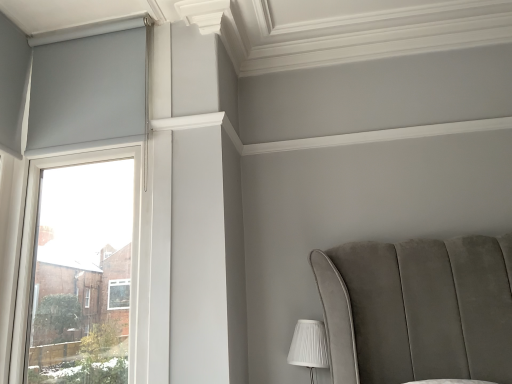
Question: Is matte gray roller blind at left smaller than white pleated fabric at lower right?

Choices:
 (A) yes
 (B) no

Answer: (B)

Question: Would you say matte gray roller blind at left is a long distance from white pleated fabric at lower right?

Choices:
 (A) yes
 (B) no

Answer: (A)

Question: Is the depth of matte gray roller blind at left greater than that of white pleated fabric at lower right?

Choices:
 (A) no
 (B) yes

Answer: (A)

Question: Is matte gray roller blind at left to the left of white pleated fabric at lower right from the viewer's perspective?

Choices:
 (A) yes
 (B) no

Answer: (A)

Question: Is matte gray roller blind at left positioned with its back to white pleated fabric at lower right?

Choices:
 (A) yes
 (B) no

Answer: (B)

Question: From a real-world perspective, is matte gray roller blind at left located higher than white pleated fabric at lower right?

Choices:
 (A) yes
 (B) no

Answer: (A)

Question: From the image's perspective, is white pleated fabric at lower right above matte gray roller blind at left?

Choices:
 (A) no
 (B) yes

Answer: (A)

Question: Is matte gray roller blind at left inside white pleated fabric at lower right?

Choices:
 (A) yes
 (B) no

Answer: (B)

Question: Is the position of white pleated fabric at lower right less distant than that of matte gray roller blind at left?

Choices:
 (A) yes
 (B) no

Answer: (B)

Question: From a real-world perspective, is white pleated fabric at lower right on top of matte gray roller blind at left?

Choices:
 (A) yes
 (B) no

Answer: (B)

Question: Is white pleated fabric at lower right far away from matte gray roller blind at left?

Choices:
 (A) no
 (B) yes

Answer: (B)

Question: From a real-world perspective, does white pleated fabric at lower right sit lower than matte gray roller blind at left?

Choices:
 (A) no
 (B) yes

Answer: (B)

Question: From the image's perspective, is white pleated fabric at lower right located above or below matte gray roller blind at left?

Choices:
 (A) below
 (B) above

Answer: (A)